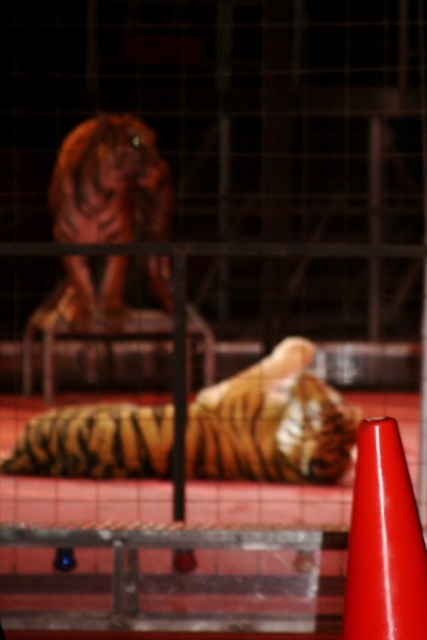
Between orange-brown fur tiger at center and orange-brown fur tiger at upper left, which one appears on the right side from the viewer's perspective?

From the viewer's perspective, orange-brown fur tiger at center appears more on the right side.

Does orange-brown fur tiger at center have a lesser height compared to orange-brown fur tiger at upper left?

Correct, orange-brown fur tiger at center is not as tall as orange-brown fur tiger at upper left.

Is point (254, 369) in front of point (154, 216)?

Yes.

Find the location of `orange-brown fur tiger at center`. orange-brown fur tiger at center is located at coordinates (271, 422).

Based on the photo, who is positioned more to the left, orange-brown fur tiger at upper left or smooth red traffic cone at lower right?

Positioned to the left is orange-brown fur tiger at upper left.

Between point (134, 136) and point (389, 572), which one is positioned behind?

The point (134, 136) is behind.

From the picture: Who is more distant from viewer, (161, 170) or (391, 518)?

Point (161, 170)

Image resolution: width=427 pixels, height=640 pixels. What are the coordinates of `orange-brown fur tiger at upper left` in the screenshot? It's located at (110, 182).

Is point (304, 448) positioned behind point (404, 515)?

Yes, it is.

Is point (295, 337) less distant than point (363, 461)?

No, it is not.

Who is more forward, (292, 342) or (374, 481)?

Point (374, 481) is more forward.

This screenshot has width=427, height=640. What are the coordinates of `orange-brown fur tiger at center` in the screenshot? It's located at (271, 422).